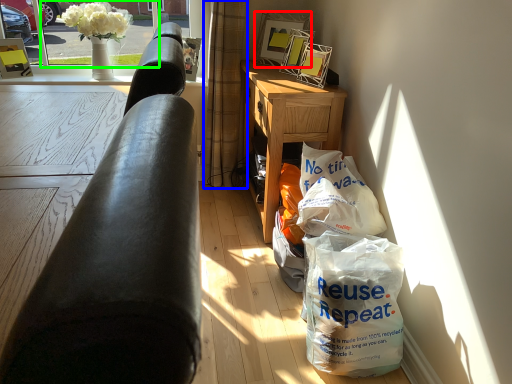
Question: Based on their relative distances, which object is farther from picture frame (highlighted by a red box)? Choose from curtain (highlighted by a blue box) and window screen (highlighted by a green box).

Choices:
 (A) curtain
 (B) window screen

Answer: (B)